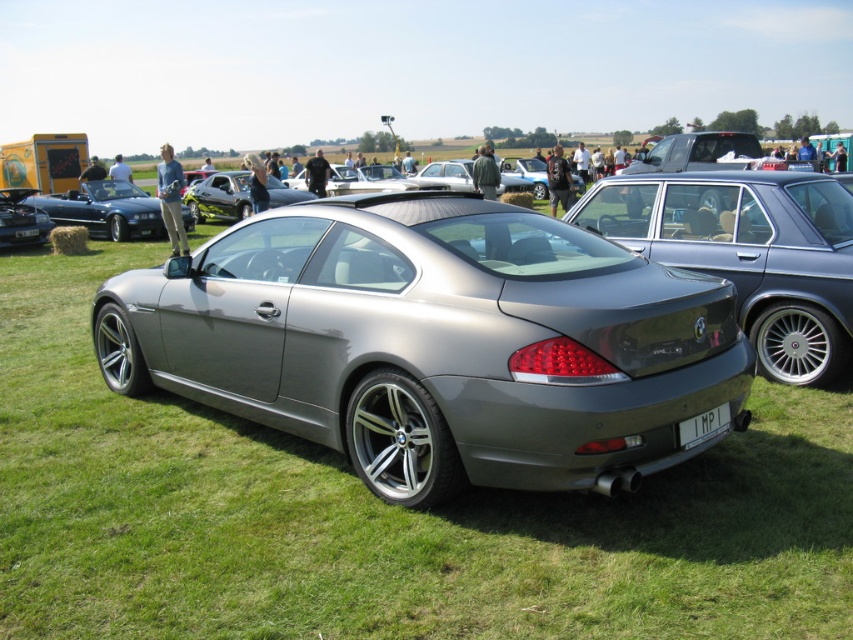
Question: Which of the following is the farthest from the observer?

Choices:
 (A) metallic silver car at center
 (B) satin metallic car at center
 (C) metallic silver car at left
 (D) white plastic license plate at center

Answer: (A)

Question: Is metallic silver car at left to the right of metallic silver car at center from the viewer's perspective?

Choices:
 (A) no
 (B) yes

Answer: (A)

Question: Which of the following is the closest to the observer?

Choices:
 (A) (637, 476)
 (B) (202, 195)
 (C) (698, 417)
 (D) (138, 208)

Answer: (A)

Question: Does metallic silver car at left have a smaller size compared to white plastic license plate at center?

Choices:
 (A) yes
 (B) no

Answer: (B)

Question: Can you confirm if metallic silver car at left is smaller than metallic silver car at center?

Choices:
 (A) yes
 (B) no

Answer: (B)

Question: Among these objects, which one is nearest to the camera?

Choices:
 (A) white plastic license plate at center
 (B) metallic silver car at left
 (C) metallic silver car at center

Answer: (A)